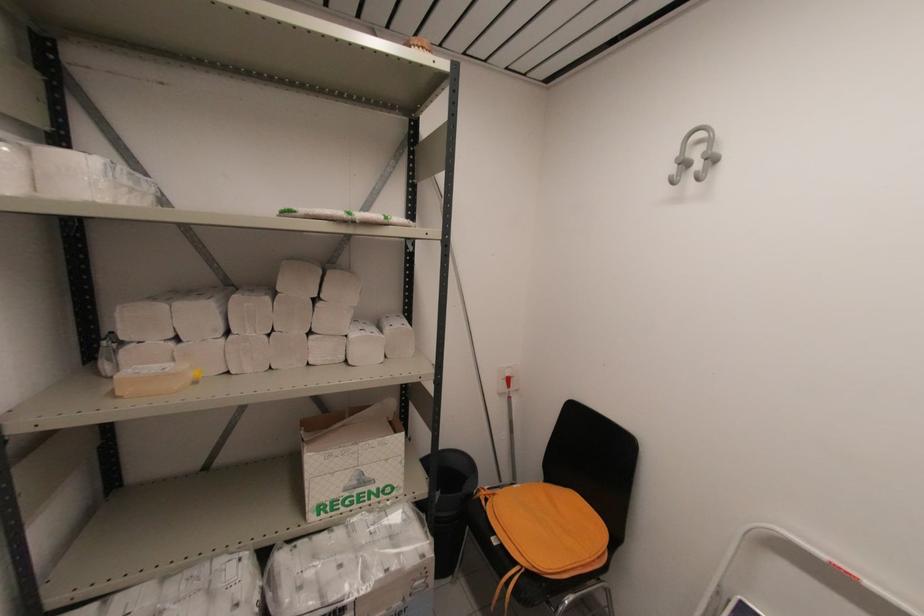
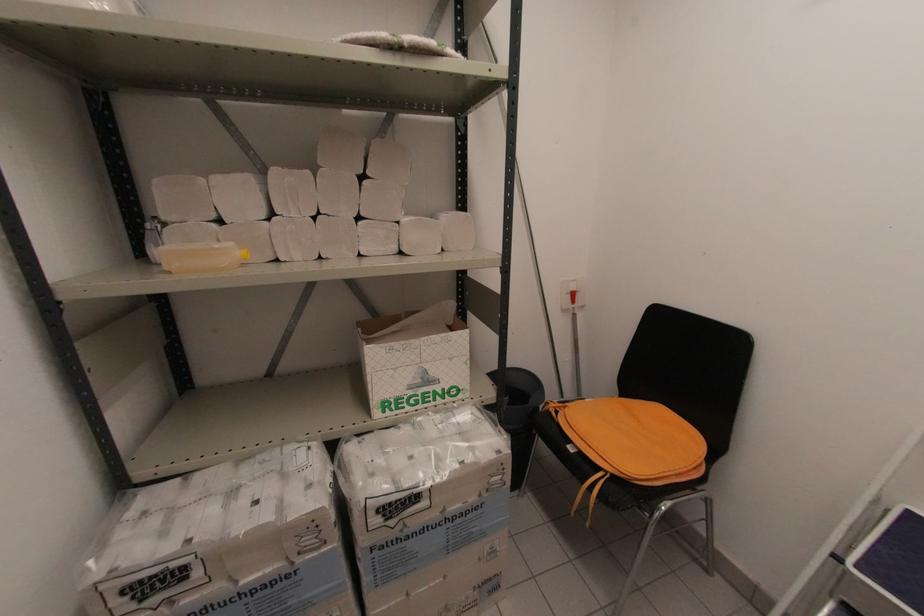
What movement of the cameraman would produce the second image?

The cameraman moved toward left, forward.